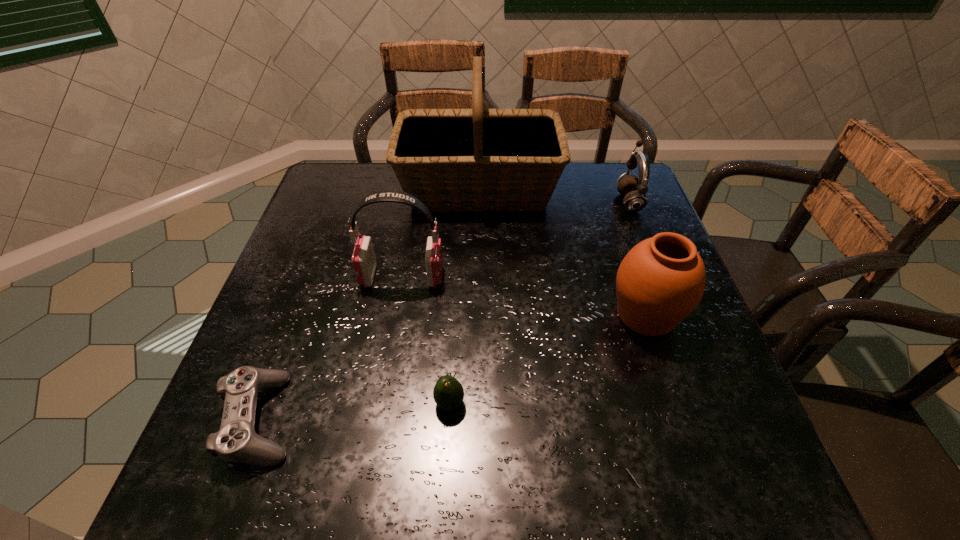
Select which object appears as the fifth closest to the tallest object. Please provide its 2D coordinates. Your answer should be formatted as a tuple, i.e. [(x, y)], where the tuple contains the x and y coordinates of a point satisfying the conditions above.

[(448, 393)]

This screenshot has height=540, width=960. Find the location of `vacant space that satisfies the following two spatial constraints: 1. on the outer surface of the second shortest object; 2. on the left side of the taller earphone`. vacant space that satisfies the following two spatial constraints: 1. on the outer surface of the second shortest object; 2. on the left side of the taller earphone is located at coordinates (381, 403).

This screenshot has width=960, height=540. I want to click on vacant space that satisfies the following two spatial constraints: 1. on the outer surface of the nearer earphone; 2. on the back side of the urn, so click(396, 315).

Identify the location of vacant space that satisfies the following two spatial constraints: 1. on the back side of the avocado; 2. on the left side of the leftmost object. (266, 403).

Find the location of a particular element. Image resolution: width=960 pixels, height=540 pixels. free spot that satisfies the following two spatial constraints: 1. on the outer surface of the taller earphone; 2. on the back side of the avocado is located at coordinates (381, 403).